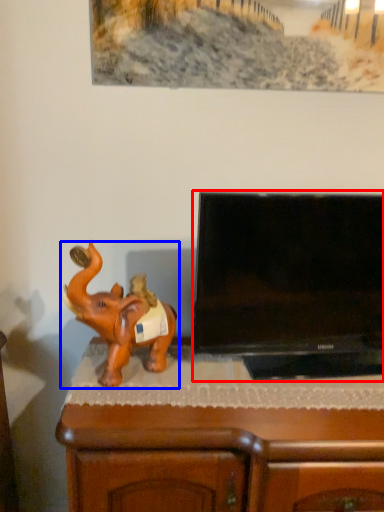
Question: Which point is closer to the camera, television (highlighted by a red box) or elephant (highlighted by a blue box)?

Choices:
 (A) television
 (B) elephant

Answer: (B)